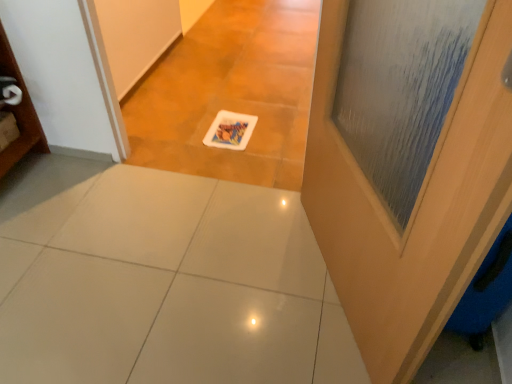
The height and width of the screenshot is (384, 512). Describe the element at coordinates (162, 281) in the screenshot. I see `white glossy tile at center` at that location.

The width and height of the screenshot is (512, 384). In order to click on white glossy tile at center in this screenshot , I will do `click(162, 281)`.

Describe the element at coordinates (407, 164) in the screenshot. I see `wooden door at right` at that location.

The height and width of the screenshot is (384, 512). In order to click on wooden door at right in this screenshot , I will do `click(407, 164)`.

This screenshot has width=512, height=384. Identify the location of white glossy tile at center. (162, 281).

Considering the positions of objects white glossy tile at center and wooden door at right in the image provided, who is more to the left, white glossy tile at center or wooden door at right?

Positioned to the left is white glossy tile at center.

Does white glossy tile at center come behind wooden door at right?

Yes, the depth of white glossy tile at center is greater than that of wooden door at right.

Which point is more forward, (x=138, y=263) or (x=478, y=76)?

The point (x=478, y=76) is in front.

From the image's perspective, which object appears higher, white glossy tile at center or wooden door at right?

wooden door at right is shown above in the image.

From the picture: From a real-world perspective, which object stands above the other?

From a 3D spatial view, wooden door at right is above.

Does white glossy tile at center have a greater width compared to wooden door at right?

Correct, the width of white glossy tile at center exceeds that of wooden door at right.

Can you confirm if white glossy tile at center is taller than wooden door at right?

In fact, white glossy tile at center may be shorter than wooden door at right.

Who is smaller, white glossy tile at center or wooden door at right?

white glossy tile at center is smaller.

Is wooden door at right located within white glossy tile at center?

No, wooden door at right is not surrounded by white glossy tile at center.

Consider the image. Is white glossy tile at center placed right next to wooden door at right?

No.

Is white glossy tile at center oriented away from wooden door at right?

white glossy tile at center is not turned away from wooden door at right.

How much distance is there between white glossy tile at center and wooden door at right?

white glossy tile at center and wooden door at right are 51.56 centimeters apart from each other.

I want to click on door that appears above the white glossy tile at center (from a real-world perspective), so click(x=407, y=164).

Is wooden door at right to the left of white glossy tile at center from the viewer's perspective?

In fact, wooden door at right is to the right of white glossy tile at center.

Between wooden door at right and white glossy tile at center, which one is positioned behind?

white glossy tile at center is behind.

Considering the positions of points (505, 125) and (73, 245), is point (505, 125) farther from camera compared to point (73, 245)?

No, it is not.

From the image's perspective, between wooden door at right and white glossy tile at center, which one is located above?

wooden door at right appears higher in the image.

From a real-world perspective, relative to white glossy tile at center, is wooden door at right vertically above or below?

From a real-world perspective, wooden door at right is physically above white glossy tile at center.

In terms of width, does wooden door at right look wider or thinner when compared to white glossy tile at center?

In the image, wooden door at right appears to be more narrow than white glossy tile at center.

Which of these two, wooden door at right or white glossy tile at center, stands shorter?

With less height is white glossy tile at center.

Can you confirm if wooden door at right is bigger than white glossy tile at center?

Correct, wooden door at right is larger in size than white glossy tile at center.

Looking at this image, is wooden door at right located outside white glossy tile at center?

Indeed, wooden door at right is completely outside white glossy tile at center.

Is wooden door at right with white glossy tile at center?

No, wooden door at right is not next to white glossy tile at center.

Could you tell me if wooden door at right is facing white glossy tile at center?

Yes, wooden door at right faces towards white glossy tile at center.

What's the angular difference between wooden door at right and white glossy tile at center's facing directions?

The angular difference between wooden door at right and white glossy tile at center is 115 degrees.

How far apart are wooden door at right and white glossy tile at center?

20.30 inches.

In order to click on door located above the white glossy tile at center (from the image's perspective) in this screenshot , I will do `click(407, 164)`.

I want to click on door above the white glossy tile at center (from a real-world perspective), so [407, 164].

Find the location of a particular element. The height and width of the screenshot is (384, 512). ceramic tile below the wooden door at right (from a real-world perspective) is located at coordinates (162, 281).